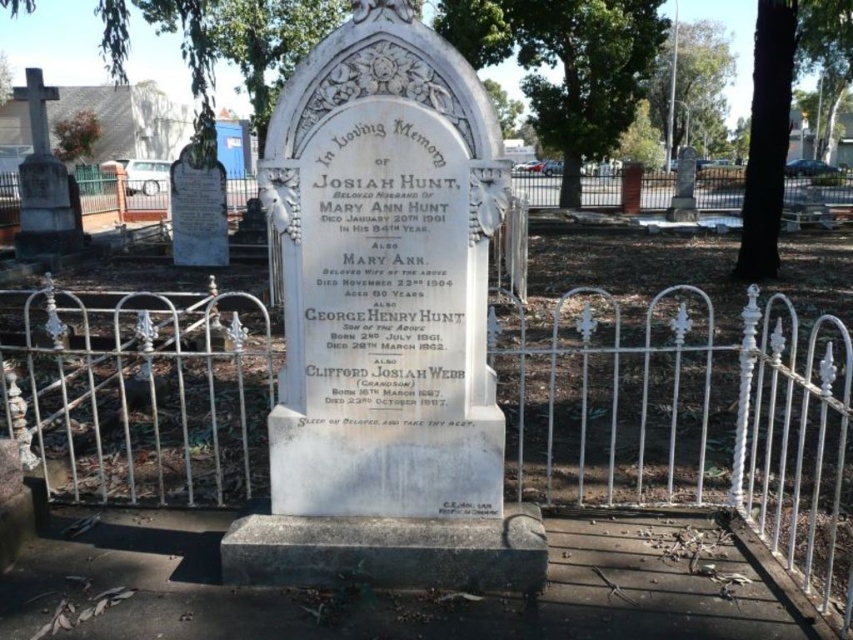
You are a groundskeeper tasked with placing a new 2.5 meter wide maintenance cart between the white wrought iron fence at upper center and the smooth white cross at left. Can the cart fit in the space between them without touching either object?

The white wrought iron fence at upper center and smooth white cross at left are 8.36 meters apart from each other. Since the cart is 2.5 meters wide, there is enough space between them to fit the cart without touching either object.